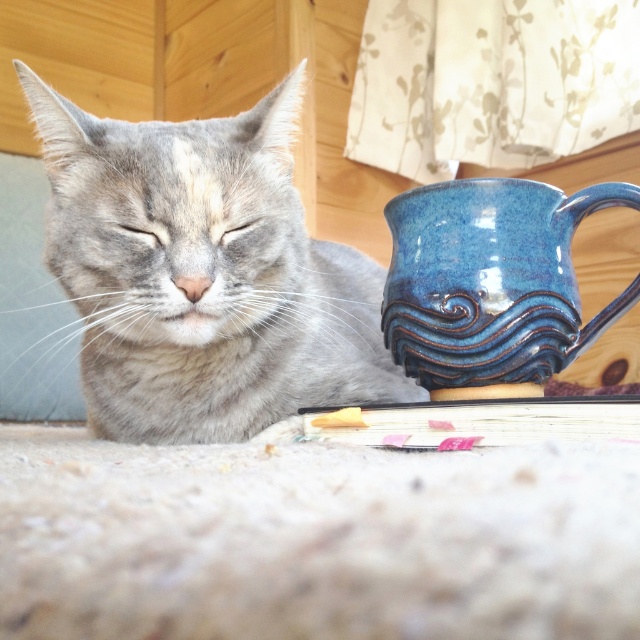
Who is positioned more to the left, gray soft fur cat at left or gray fur eye at center?

gray fur eye at center is more to the left.

Does point (168, 358) come farther from viewer compared to point (252, 227)?

Yes, point (168, 358) is farther from viewer.

Who is more distant from viewer, [204,433] or [234,237]?

Point [204,433]

I want to click on gray soft fur cat at left, so click(x=204, y=275).

Can you confirm if gray soft fur cat at left is positioned above gray fur eye at upper left?

No.

Measure the distance between gray soft fur cat at left and gray fur eye at upper left.

gray soft fur cat at left is 10.59 inches away from gray fur eye at upper left.

Is point (308, 392) more distant than point (147, 236)?

Yes, point (308, 392) is farther from viewer.

Identify the location of gray soft fur cat at left. This screenshot has width=640, height=640. (204, 275).

The image size is (640, 640). What do you see at coordinates (490, 280) in the screenshot?
I see `blue glazed mug at right` at bounding box center [490, 280].

Is point (438, 250) positioned behind point (156, 236)?

No, (438, 250) is in front of (156, 236).

Does point (420, 372) come farther from viewer compared to point (134, 225)?

That is True.

Find the location of a particular element. Image resolution: width=640 pixels, height=640 pixels. blue glazed mug at right is located at coordinates (490, 280).